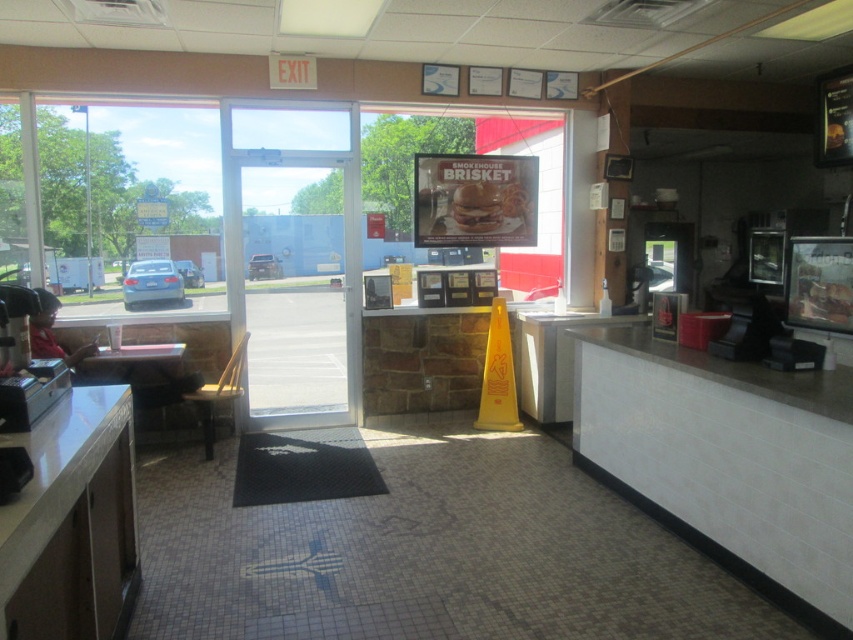
Question: Can you confirm if transparent glass window at left is bigger than white laminate counter at lower left?

Choices:
 (A) yes
 (B) no

Answer: (B)

Question: Which object appears farthest from the camera in this image?

Choices:
 (A) white laminate counter at center
 (B) matte plastic chair at center
 (C) transparent glass door at center

Answer: (C)

Question: Can you confirm if transparent glass door at center is thinner than white laminate counter at lower left?

Choices:
 (A) yes
 (B) no

Answer: (B)

Question: Is transparent glass door at center above black rubber mat at center?

Choices:
 (A) yes
 (B) no

Answer: (A)

Question: Which object is closer to the camera taking this photo?

Choices:
 (A) black rubber mat at center
 (B) white laminate counter at lower left
 (C) matte plastic chair at center
 (D) transparent glass window at left

Answer: (B)

Question: Which point appears closest to the camera in this image?

Choices:
 (A) (235, 387)
 (B) (281, 131)

Answer: (A)